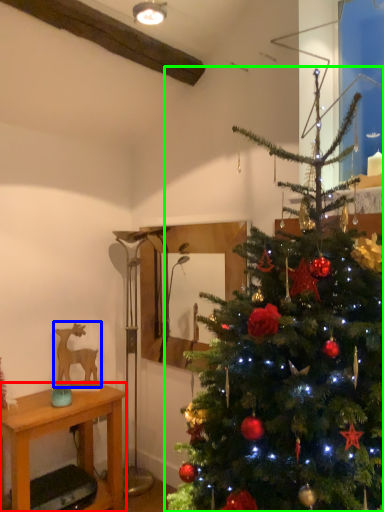
Question: Based on their relative distances, which object is farther from desk (highlighted by a red box)? Choose from animal (highlighted by a blue box) and christmas tree (highlighted by a green box).

Choices:
 (A) animal
 (B) christmas tree

Answer: (B)